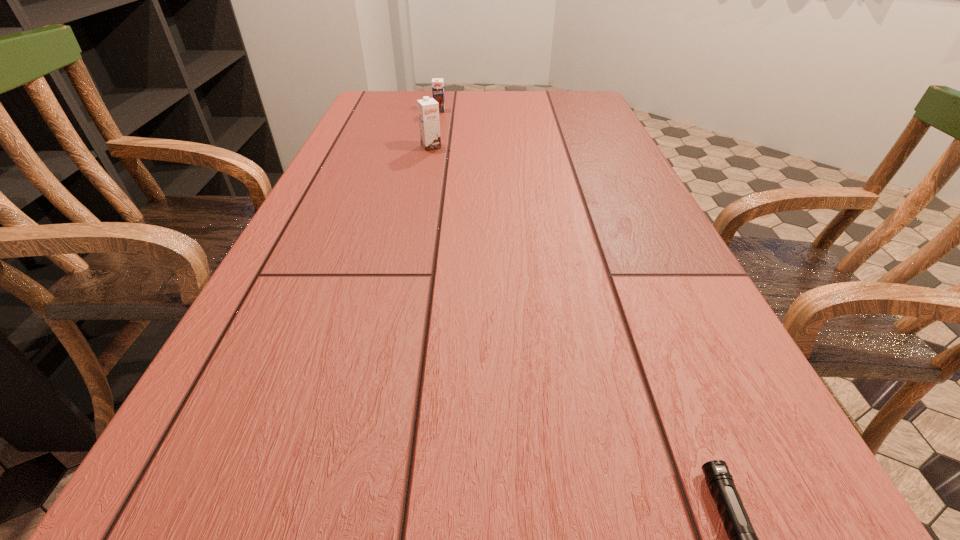
You are a GUI agent. You are given a task and a screenshot of the screen. Output one action in this format:
    pyautogui.click(x=<x>, y=<y>)
    Task: Click on the second nearest object
    Image resolution: width=960 pixels, height=540 pixels.
    Given the screenshot: What is the action you would take?
    pyautogui.click(x=428, y=109)

What are the coordinates of `the taller chocolate milk` in the screenshot? It's located at (428, 109).

I want to click on the farther chocolate milk, so click(437, 83).

I want to click on the farthest object, so click(x=437, y=83).

Find the location of a particular element. This screenshot has height=540, width=960. free location located on the front of the taller chocolate milk is located at coordinates (420, 206).

At what (x,y) coordinates should I click in order to perform the action: click on free space located 0.080m on the front label of the farthest object. Please return your answer as a coordinate pair (x, y). This screenshot has height=540, width=960. Looking at the image, I should click on (437, 123).

What are the coordinates of `object situated at the far edge` in the screenshot? It's located at (437, 83).

In the image, there is a desktop. Identify the location of vacant space at the far edge. (479, 94).

Image resolution: width=960 pixels, height=540 pixels. In order to click on blank area at the left edge in this screenshot , I will do `click(313, 246)`.

The height and width of the screenshot is (540, 960). In the image, there is a desktop. Identify the location of free space at the right edge. (611, 183).